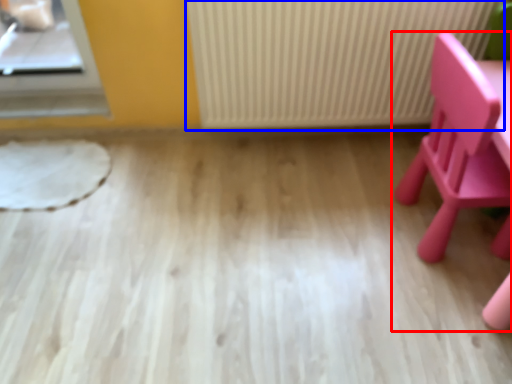
Question: Which of the following is the farthest to the observer, chair (highlighted by a red box) or radiator (highlighted by a blue box)?

Choices:
 (A) chair
 (B) radiator

Answer: (B)